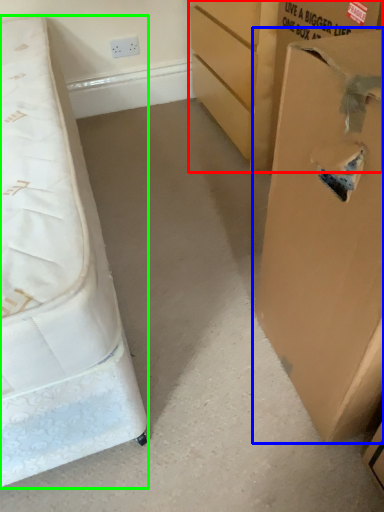
Question: Which is farther away from cardboard box (highlighted by a red box)? cardboard box (highlighted by a blue box) or bed (highlighted by a green box)?

Choices:
 (A) cardboard box
 (B) bed

Answer: (B)